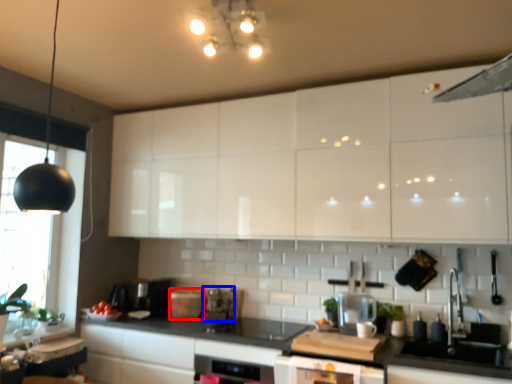
Question: Which object appears farthest to the camera in this image, appliance (highlighted by a red box) or appliance (highlighted by a blue box)?

Choices:
 (A) appliance
 (B) appliance

Answer: (B)